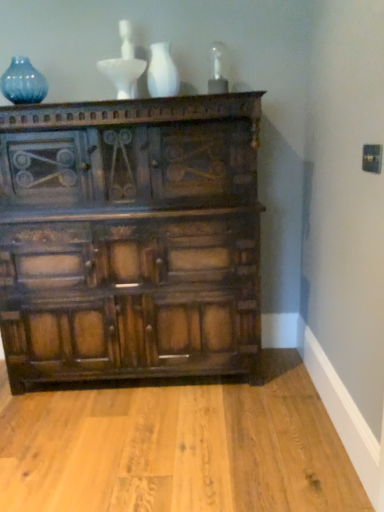
At what (x,y) coordinates should I click in order to perform the action: click on free space above blue glass vase at upper left (from a real-world perspective). Please return your answer as a coordinate pair (x, y). This screenshot has height=512, width=384. Looking at the image, I should click on (21, 61).